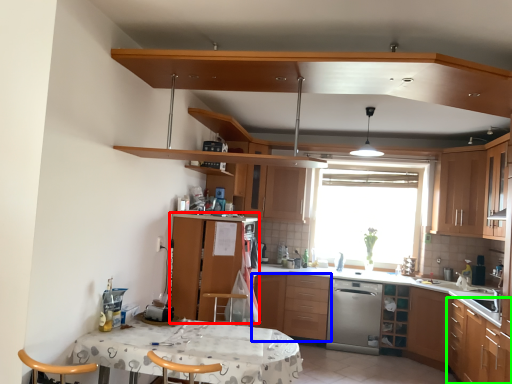
Question: Which object is positioned closest to cabinetry (highlighted by a red box)? Select from cabinetry (highlighted by a blue box) and cabinetry (highlighted by a green box).

Choices:
 (A) cabinetry
 (B) cabinetry

Answer: (A)